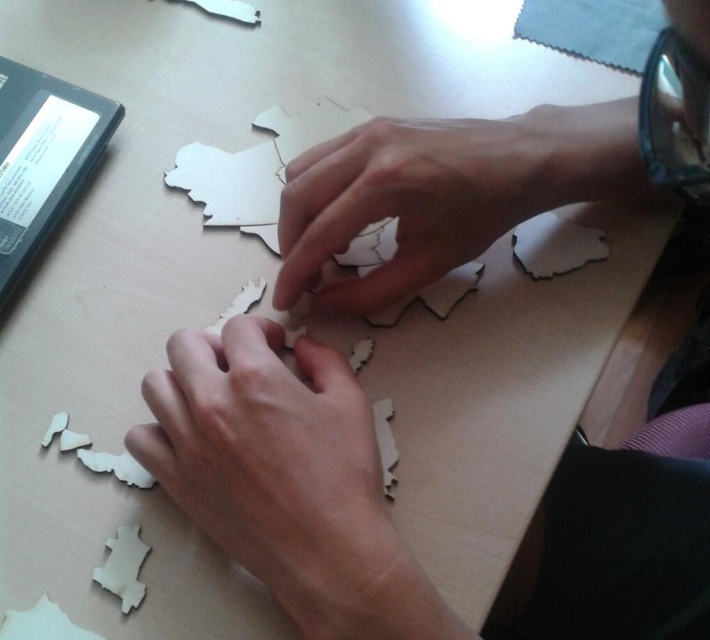
Consider the image. How much distance is there between matte wood hand at center and wooden puzzle piece at center?

matte wood hand at center is 4.41 inches from wooden puzzle piece at center.

Does matte wood hand at center lie in front of wooden puzzle piece at center?

That is True.

The width and height of the screenshot is (710, 640). Describe the element at coordinates (273, 467) in the screenshot. I see `matte wood hand at center` at that location.

Locate an element on the screen. matte wood hand at center is located at coordinates (273, 467).